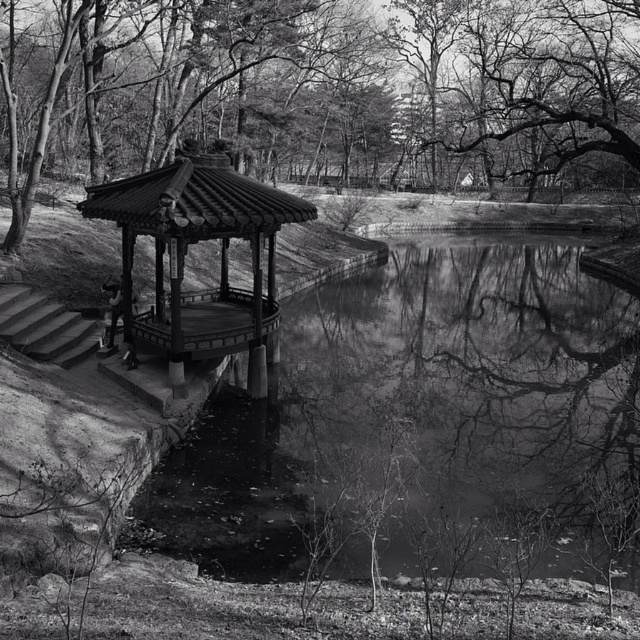
Does smooth bark tree at center have a larger size compared to wooden gazebo at center?

Yes.

Is point (13, 163) positioned behind point (145, 196)?

Yes.

At what (x,y) coordinates should I click in order to perform the action: click on smooth bark tree at center. Please return your answer as a coordinate pair (x, y). Image resolution: width=640 pixels, height=640 pixels. Looking at the image, I should click on (323, 88).